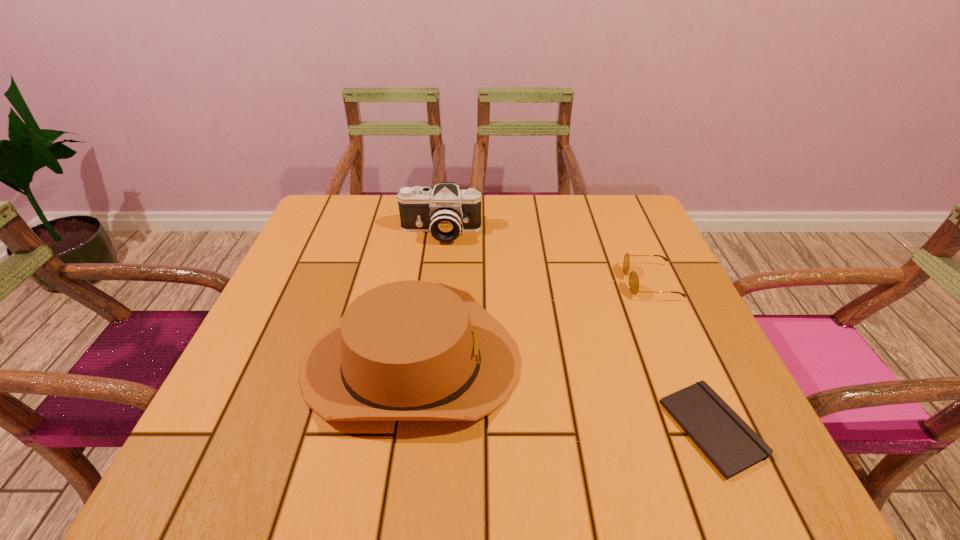
In the image, there is a desktop. Identify the location of vacant region at the near edge. The width and height of the screenshot is (960, 540). (427, 469).

Identify the location of vacant area at the left edge. (293, 258).

The width and height of the screenshot is (960, 540). What are the coordinates of `vacant area at the right edge of the desktop` in the screenshot? It's located at (646, 320).

Find the location of `free spot at the far left corner of the desktop`. free spot at the far left corner of the desktop is located at coordinates (351, 205).

You are a GUI agent. You are given a task and a screenshot of the screen. Output one action in this format:
    pyautogui.click(x=<x>, y=<y>)
    Task: Click on the vacant space at the far right corner of the desktop
    The height and width of the screenshot is (540, 960).
    Given the screenshot: What is the action you would take?
    pyautogui.click(x=617, y=236)

In order to click on free space at the near right corner of the desktop in this screenshot , I will do `click(660, 438)`.

The height and width of the screenshot is (540, 960). Identify the location of empty space between the checkbook and the camera. (576, 330).

Where is `vacant space in between the shortest object and the camera`? vacant space in between the shortest object and the camera is located at coordinates (576, 330).

Locate an element on the screen. The image size is (960, 540). unoccupied area between the cowboy hat and the second shortest object is located at coordinates (531, 322).

At what (x,y) coordinates should I click in order to perform the action: click on free area in between the sunglasses and the cowboy hat. Please return your answer as a coordinate pair (x, y). This screenshot has height=540, width=960. Looking at the image, I should click on (531, 322).